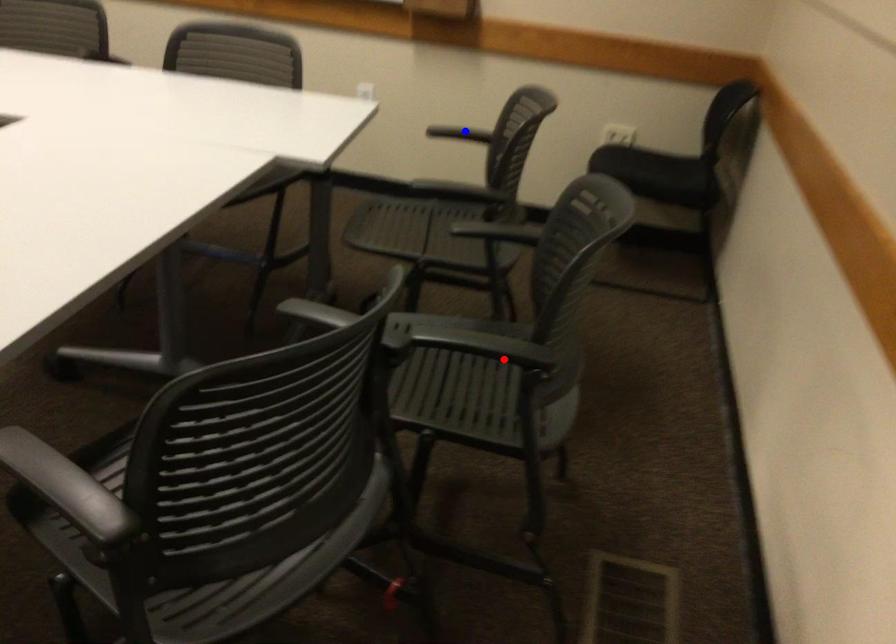
Question: In the image, two points are highlighted. Which point is nearer to the camera? Reply with the corresponding letter.

Choices:
 (A) blue point
 (B) red point

Answer: (B)